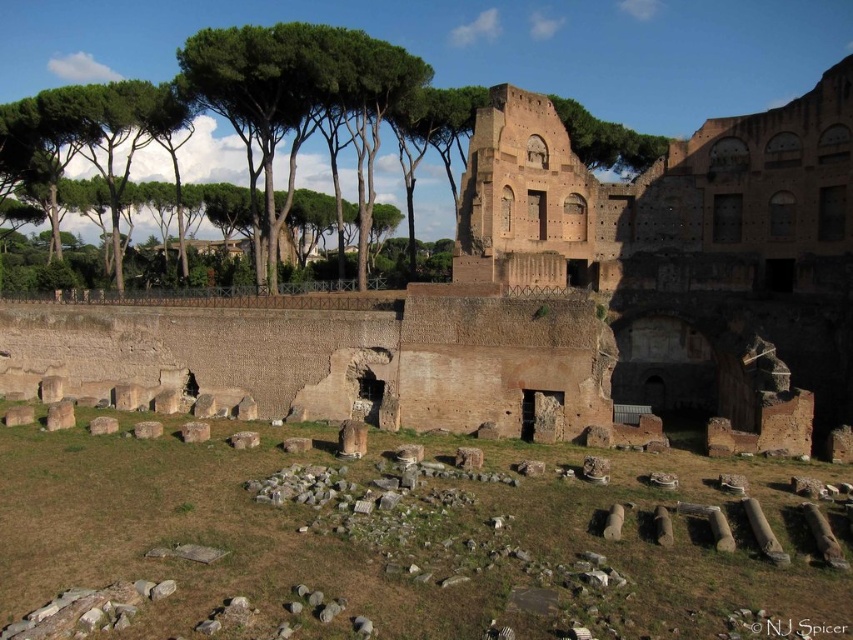
Does brown brick amphitheater at center have a smaller size compared to transparent watermark at upper center?

No, brown brick amphitheater at center is not smaller than transparent watermark at upper center.

Measure the distance from brown brick amphitheater at center to transparent watermark at upper center.

brown brick amphitheater at center and transparent watermark at upper center are 127.35 feet apart.

The image size is (853, 640). What are the coordinates of `brown brick amphitheater at center` in the screenshot? It's located at (554, 291).

The height and width of the screenshot is (640, 853). I want to click on brown brick amphitheater at center, so click(x=554, y=291).